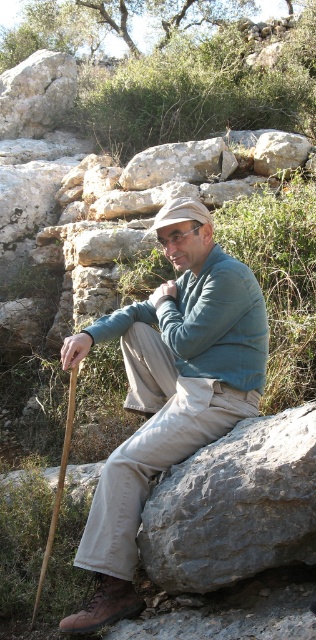
You are a hiker who wants to place your backpack on the ground between the khaki cotton pants at center and the rough gray rock at center. Based on their positions, which object should you position your backpack closer to in order to be exactly in the middle between them?

The khaki cotton pants at center is to the left of rough gray rock at center, so to place the backpack exactly in the middle between them, position it closer to the khaki cotton pants at center since it is the leftmost object.

You are a hiker who wants to place your backpack on the gray rough rock at center and the rough gray rock at center. Which rock should you choose if you want to place it on top of the other?

The gray rough rock at center is positioned under rough gray rock at center, so you should place your backpack on top of the rough gray rock at center.